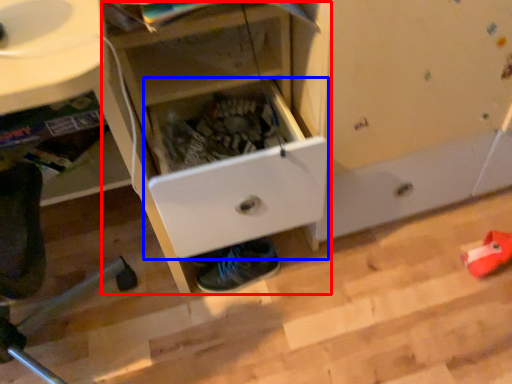
Question: Which object is closer to the camera taking this photo, cabinetry (highlighted by a red box) or drawer (highlighted by a blue box)?

Choices:
 (A) cabinetry
 (B) drawer

Answer: (A)